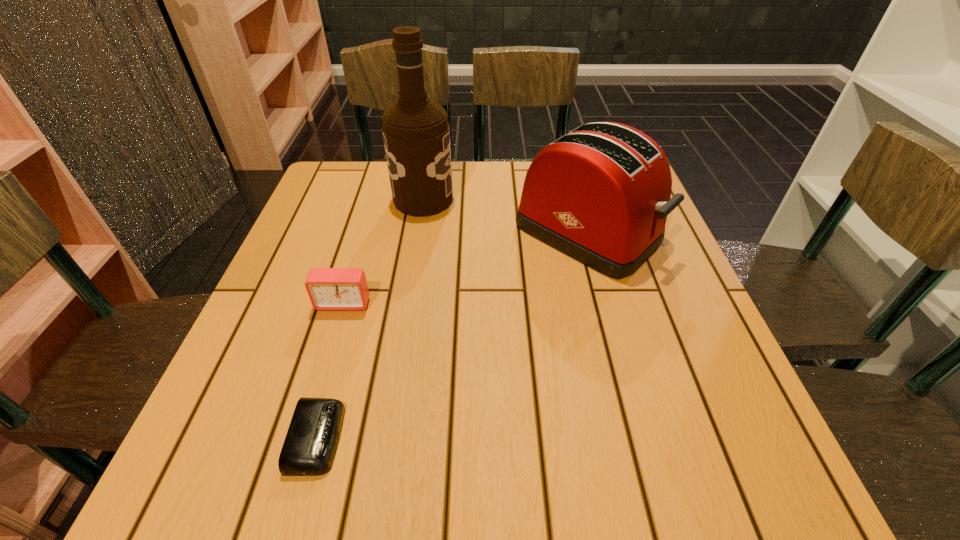
Identify the location of vacant position at the right edge of the desktop. (633, 314).

Locate an element on the screen. Image resolution: width=960 pixels, height=540 pixels. blank region between the farther alarm clock and the nearer alarm clock is located at coordinates (330, 370).

Locate an element on the screen. The image size is (960, 540). free space between the nearer alarm clock and the second tallest object is located at coordinates coord(452,335).

At what (x,y) coordinates should I click in order to perform the action: click on free space between the alcohol and the second nearest object. Please return your answer as a coordinate pair (x, y). This screenshot has width=960, height=540. Looking at the image, I should click on [383, 251].

The height and width of the screenshot is (540, 960). Find the location of `free space between the toaster and the shorter alarm clock`. free space between the toaster and the shorter alarm clock is located at coordinates (452, 335).

The height and width of the screenshot is (540, 960). I want to click on vacant area that lies between the second nearest object and the alcohol, so click(x=383, y=251).

The width and height of the screenshot is (960, 540). In order to click on empty location between the rightmost object and the tallest object in this screenshot , I will do `click(505, 216)`.

The width and height of the screenshot is (960, 540). In order to click on empty space between the nearest object and the alcohol in this screenshot , I will do `click(370, 319)`.

Identify the location of free space between the nearest object and the third shortest object. (452, 335).

Identify the location of free space between the farther alarm clock and the tallest object. The image size is (960, 540). (383, 251).